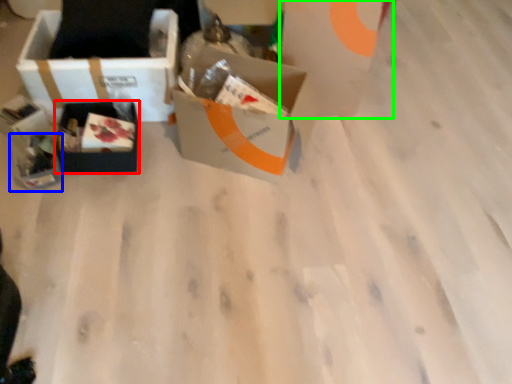
Question: Which is nearer to the box (highlighted by a red box)? gift box (highlighted by a blue box) or cardboard box (highlighted by a green box).

Choices:
 (A) gift box
 (B) cardboard box

Answer: (A)